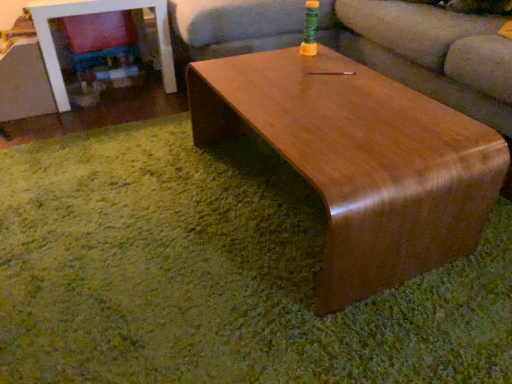
Question: Considering the positions of glossy wood table at center and shiny brown wood coffee table at center in the image, is glossy wood table at center taller or shorter than shiny brown wood coffee table at center?

Choices:
 (A) tall
 (B) short

Answer: (A)

Question: From a real-world perspective, is glossy wood table at center positioned above or below shiny brown wood coffee table at center?

Choices:
 (A) below
 (B) above

Answer: (B)

Question: Which object is the closest to the shiny brown wood coffee table at center?

Choices:
 (A) glossy wood table at center
 (B) matte brown couch at center

Answer: (B)

Question: Estimate the real-world distances between objects in this image. Which object is closer to the matte brown couch at center?

Choices:
 (A) shiny brown wood coffee table at center
 (B) glossy wood table at center

Answer: (A)